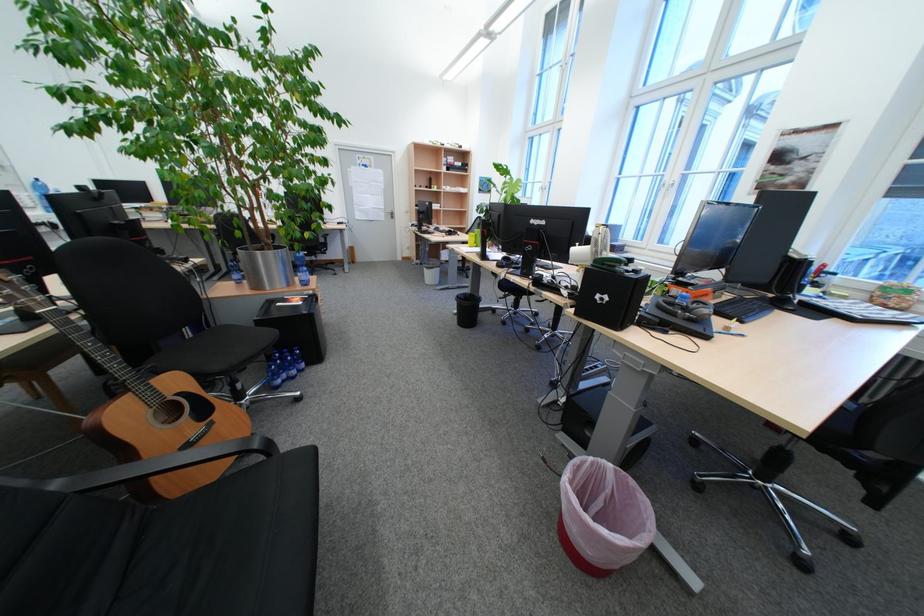
Find where to resting arm the black chair armrest. Please return your answer as a coordinate pair (x, y).

(159, 466)